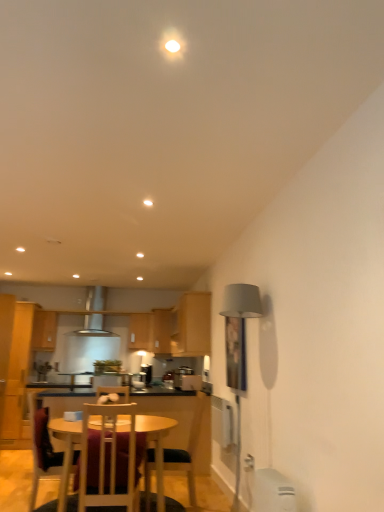
Measure the distance between point (143, 336) and camera.

7.84 meters.

This screenshot has width=384, height=512. What are the coordinates of `wooden cabinet at center, the second cabinetry from the back` in the screenshot? It's located at [140, 331].

What is the approximate width of wooden table at center?

The width of wooden table at center is 3.87 feet.

Looking at this image, measure the distance between metallic silver toaster at center, which is counted as the second appliance, starting from the back, and camera.

A distance of 4.84 meters exists between metallic silver toaster at center, which is counted as the second appliance, starting from the back, and camera.

What do you see at coordinates (191, 382) in the screenshot?
I see `metallic silver toaster at center, the 1th appliance when ordered from front to back` at bounding box center [191, 382].

This screenshot has height=512, width=384. In order to click on satin silver exhaust hood at center in this screenshot , I will do `click(94, 314)`.

Measure the distance between point (37, 326) and camera.

6.60 meters.

Describe the element at coordinates (44, 330) in the screenshot. I see `wooden cabinet at upper left, the 4th cabinetry from the right` at that location.

Locate an element on the screen. This screenshot has height=512, width=384. wooden cabinet at center, the first cabinetry viewed from the back is located at coordinates (161, 331).

From the satin silver toaster at center, the second appliance positioned from the front, count the 3rd chair to the left and point to it. Please provide its 2D coordinates.

[(41, 446)]

Do you think satin silver toaster at center, which is counted as the 1th appliance, starting from the back, is within wooden chair at lower left, the 3th chair positioned from the right, or outside of it?

satin silver toaster at center, which is counted as the 1th appliance, starting from the back, is not inside wooden chair at lower left, the 3th chair positioned from the right, it's outside.

Looking at the image, does satin silver toaster at center, which is counted as the 1th appliance, starting from the back, seem bigger or smaller compared to wooden chair at lower left, the first chair from the left?

Considering their sizes, satin silver toaster at center, which is counted as the 1th appliance, starting from the back, takes up less space than wooden chair at lower left, the first chair from the left.

Is satin silver toaster at center, which is counted as the 1th appliance, starting from the back, in front of or behind wooden chair at lower left, the 3th chair positioned from the right, in the image?

satin silver toaster at center, which is counted as the 1th appliance, starting from the back, is positioned farther from the viewer than wooden chair at lower left, the 3th chair positioned from the right.

In the image, is wooden cabinet at upper left, marked as the 3th cabinetry in a back-to-front arrangement, positioned in front of or behind wooden table at center?

Clearly, wooden cabinet at upper left, marked as the 3th cabinetry in a back-to-front arrangement, is behind wooden table at center.

Is wooden cabinet at upper left, the 4th cabinetry from the right, looking in the opposite direction of wooden table at center?

No, wooden cabinet at upper left, the 4th cabinetry from the right, is not facing the opposite direction of wooden table at center.

Is wooden table at center surrounded by wooden cabinet at upper left, the 4th cabinetry from the right?

No, wooden cabinet at upper left, the 4th cabinetry from the right, does not contain wooden table at center.

Based on their sizes in the image, would you say satin silver toaster at center, which is counted as the 1th appliance, starting from the back, is bigger or smaller than wooden cabinet at upper left, marked as the 3th cabinetry in a back-to-front arrangement?

Clearly, satin silver toaster at center, which is counted as the 1th appliance, starting from the back, is smaller in size than wooden cabinet at upper left, marked as the 3th cabinetry in a back-to-front arrangement.

In the scene shown: From a real-world perspective, which object rests below the other?

From a 3D spatial view, satin silver toaster at center, which is counted as the 1th appliance, starting from the back, is below.

From the image's perspective, which object appears higher, satin silver toaster at center, the second appliance positioned from the front, or wooden cabinet at upper left, marked as the 3th cabinetry in a back-to-front arrangement?

wooden cabinet at upper left, marked as the 3th cabinetry in a back-to-front arrangement, from the image's perspective.

Could metallic silver toaster at center, which is counted as the second appliance, starting from the back, be considered to be inside wooden chair at center, which is the 1th chair in right-to-left order?

No.

How many degrees apart are the facing directions of wooden chair at center, marked as the third chair in a left-to-right arrangement, and metallic silver toaster at center, the 1th appliance when ordered from front to back?

The angle between the facing direction of wooden chair at center, marked as the third chair in a left-to-right arrangement, and the facing direction of metallic silver toaster at center, the 1th appliance when ordered from front to back, is 2.41 degrees.

This screenshot has height=512, width=384. What are the coordinates of `the 2nd chair positioned below the metallic silver toaster at center, the 1th appliance when ordered from front to back (from the image's perspective)` in the screenshot? It's located at (189, 446).

Consider the image. In terms of height, does wooden chair at center, which is the 1th chair in right-to-left order, look taller or shorter compared to metallic silver toaster at center, the 1th appliance when ordered from front to back?

Considering their sizes, wooden chair at center, which is the 1th chair in right-to-left order, has more height than metallic silver toaster at center, the 1th appliance when ordered from front to back.

Is metallic silver toaster at center, the 1th appliance when ordered from front to back, completely or partially inside wooden chair at lower left, the first chair from the left?

No, metallic silver toaster at center, the 1th appliance when ordered from front to back, is not surrounded by wooden chair at lower left, the first chair from the left.

Is wooden chair at lower left, the first chair from the left, placed right next to metallic silver toaster at center, the 1th appliance when ordered from front to back?

No.

Considering the relative sizes of wooden chair at lower left, the 3th chair positioned from the right, and metallic silver toaster at center, the 1th appliance when ordered from front to back, in the image provided, is wooden chair at lower left, the 3th chair positioned from the right, wider than metallic silver toaster at center, the 1th appliance when ordered from front to back,?

Yes, wooden chair at lower left, the 3th chair positioned from the right, is wider than metallic silver toaster at center, the 1th appliance when ordered from front to back.

Considering the positions of objects wooden chair at lower left, the 3th chair positioned from the right, and metallic silver toaster at center, which is counted as the second appliance, starting from the back, in the image provided, who is more to the right, wooden chair at lower left, the 3th chair positioned from the right, or metallic silver toaster at center, which is counted as the second appliance, starting from the back,?

From the viewer's perspective, metallic silver toaster at center, which is counted as the second appliance, starting from the back, appears more on the right side.

Does wooden table at center come in front of metallic silver toaster at center, the 1th appliance when ordered from front to back?

That is True.

From the image's perspective, relative to metallic silver toaster at center, which is counted as the second appliance, starting from the back, is wooden table at center above or below?

wooden table at center is below metallic silver toaster at center, which is counted as the second appliance, starting from the back.

From their relative heights in the image, would you say wooden table at center is taller or shorter than metallic silver toaster at center, which is counted as the second appliance, starting from the back?

In the image, wooden table at center appears to be taller than metallic silver toaster at center, which is counted as the second appliance, starting from the back.

From a real-world perspective, which object rests below the other?

wooden table at center is physically lower.

Which object is positioned more to the left, wooden chair at lower left, the 3th chair positioned from the right, or wooden chair at center, marked as the third chair in a left-to-right arrangement?

wooden chair at lower left, the 3th chair positioned from the right, is more to the left.

Between wooden chair at lower left, the first chair from the left, and wooden chair at center, marked as the third chair in a left-to-right arrangement, which one is positioned in front?

wooden chair at lower left, the first chair from the left.

Is wooden chair at lower left, the 3th chair positioned from the right, positioned far away from wooden chair at center, which is the 1th chair in right-to-left order?

That's right, there is a large distance between wooden chair at lower left, the 3th chair positioned from the right, and wooden chair at center, which is the 1th chair in right-to-left order.

From the image's perspective, does wooden chair at lower left, the 3th chair positioned from the right, appear lower than wooden chair at center, which is the 1th chair in right-to-left order?

No, from the image's perspective, wooden chair at lower left, the 3th chair positioned from the right, is not below wooden chair at center, which is the 1th chair in right-to-left order.

From the satin silver toaster at center, which is counted as the 1th appliance, starting from the back, count 2nd chairs forward and point to it. Please provide its 2D coordinates.

[(41, 446)]

In the image, there is a wooden cabinet at upper left, marked as the 2th cabinetry in a front-to-back arrangement. Identify the location of kitchen & dining room table below it (from a real-world perspective). The width and height of the screenshot is (384, 512). (156, 446).

When comparing their distances from wooden cabinet at center, the 3th cabinetry in the left-to-right sequence, does metallic silver toaster at center, which is counted as the second appliance, starting from the back, or wooden table at center seem closer?

Among the two, metallic silver toaster at center, which is counted as the second appliance, starting from the back, is located nearer to wooden cabinet at center, the 3th cabinetry in the left-to-right sequence.

From the image, which object appears to be farther from wooden cabinet at center, which is the second cabinetry in left-to-right order, metallic silver toaster at center, which is counted as the second appliance, starting from the back, or wooden cabinet at center, the 3th cabinetry in the left-to-right sequence?

Based on the image, metallic silver toaster at center, which is counted as the second appliance, starting from the back, appears to be further to wooden cabinet at center, which is the second cabinetry in left-to-right order.

Looking at the image, which one is located closer to wooden chair at center, positioned as the second chair in left-to-right order, wooden chair at lower left, the first chair from the left, or wooden cabinet at upper left, marked as the 3th cabinetry in a back-to-front arrangement?

wooden chair at lower left, the first chair from the left, is closer to wooden chair at center, positioned as the second chair in left-to-right order.

Which object lies further to the anchor point wooden chair at center, positioned as the second chair in left-to-right order, metallic silver toaster at center, which is counted as the second appliance, starting from the back, or wooden cabinet at upper left, which appears as the 1th cabinetry when viewed from the left?

wooden cabinet at upper left, which appears as the 1th cabinetry when viewed from the left, is positioned further to the anchor wooden chair at center, positioned as the second chair in left-to-right order.

Estimate the real-world distances between objects in this image. Which object is closer to satin silver toaster at center, the second appliance positioned from the front, wooden chair at center, which is the 1th chair in right-to-left order, or metallic silver toaster at center, which is counted as the second appliance, starting from the back?

Among the two, metallic silver toaster at center, which is counted as the second appliance, starting from the back, is located nearer to satin silver toaster at center, the second appliance positioned from the front.

When comparing their distances from wooden table at center, does satin silver toaster at center, the second appliance positioned from the front, or metallic silver toaster at center, which is counted as the second appliance, starting from the back, seem closer?

Based on the image, metallic silver toaster at center, which is counted as the second appliance, starting from the back, appears to be nearer to wooden table at center.

From the picture: Estimate the real-world distances between objects in this image. Which object is further from wooden chair at lower left, the 3th chair positioned from the right, wooden cabinet at center, the 3th cabinetry in the left-to-right sequence, or satin silver exhaust hood at center?

The object further to wooden chair at lower left, the 3th chair positioned from the right, is wooden cabinet at center, the 3th cabinetry in the left-to-right sequence.

From the image, which object appears to be farther from wooden chair at lower left, the 3th chair positioned from the right, wooden chair at center, positioned as the second chair in left-to-right order, or wooden cabinet at center, the 3th cabinetry in the left-to-right sequence?

wooden cabinet at center, the 3th cabinetry in the left-to-right sequence, lies further to wooden chair at lower left, the 3th chair positioned from the right, than the other object.

Find the location of a particular element. This screenshot has height=512, width=384. exhaust hood between metallic silver toaster at center, which is counted as the second appliance, starting from the back, and wooden cabinet at center, which appears as the second cabinetry when viewed from the right, in the front-back direction is located at coordinates (94, 314).

The height and width of the screenshot is (512, 384). I want to click on appliance located between wooden chair at center, marked as the third chair in a left-to-right arrangement, and satin silver toaster at center, the second appliance positioned from the front, in the depth direction, so click(191, 382).

The width and height of the screenshot is (384, 512). Find the location of `exhaust hood between wooden cabinet at upper left, which appears as the 1th cabinetry when viewed from the left, and wooden cabinet at center, which appears as the 4th cabinetry when viewed from the left`. exhaust hood between wooden cabinet at upper left, which appears as the 1th cabinetry when viewed from the left, and wooden cabinet at center, which appears as the 4th cabinetry when viewed from the left is located at coordinates (94, 314).

Identify the location of appliance between metallic silver toaster at center, which is counted as the second appliance, starting from the back, and wooden cabinet at center, the second cabinetry from the back, from front to back. The height and width of the screenshot is (512, 384). (181, 376).